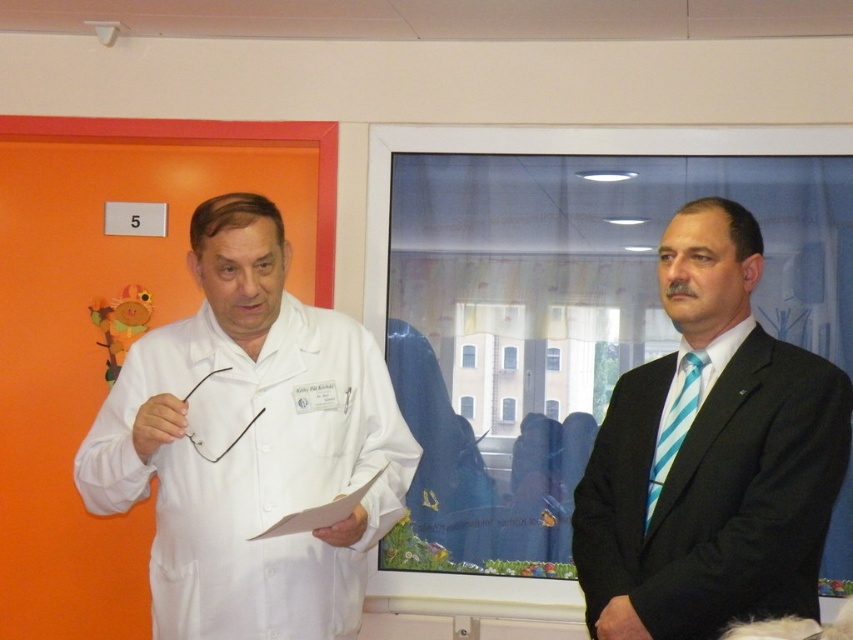
You are a photographer trying to capture both the white matte lab coat at left and the matte white coat at center in a single frame. Since the camera can only focus on one object at a time, which coat should you focus on to ensure the larger one is in focus?

The white matte lab coat at left is larger in size than the matte white coat at center, so you should focus on the white matte lab coat at left to ensure the larger one is in focus.

You are an interior designer planning to place a 1.2 meter wide decorative panel between the matte white coat at center and the teal striped tie at right. Based on their widths, will the panel fit between them?

The matte white coat at center might be wider than teal striped tie at right, so the panel may not fit between them if the combined width of both objects exceeds 1.2 meters. However, without exact measurements, it is uncertain.

You are standing in a professional setting and want to place a 1.5 meter long banner between you and the point at (717, 353). Can the banner fit without overlapping anything?

The distance between you and the point at (717, 353) is 1.83 meters, so the 1.5 meter banner can fit without overlapping anything since it is shorter than the available space.